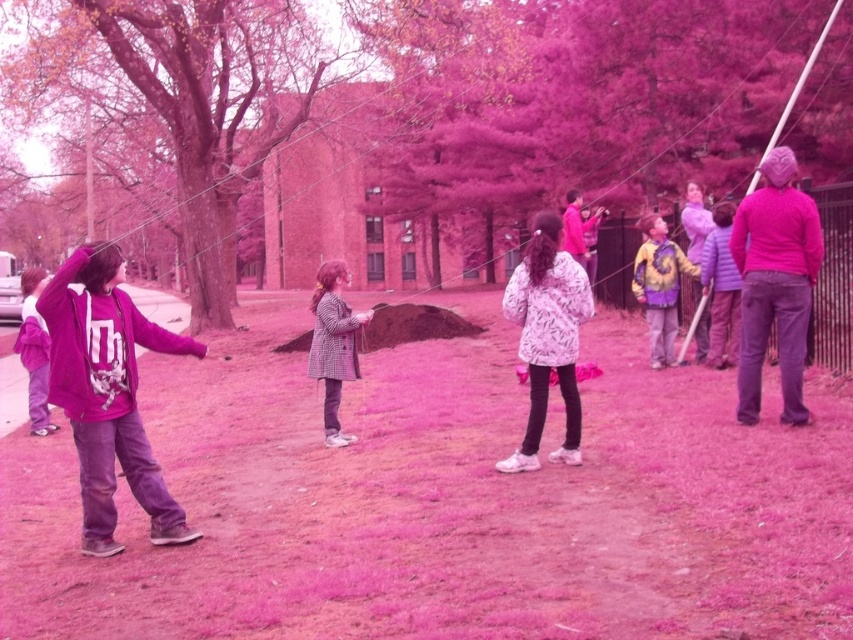
Question: Is purple matte hoodie at left thinner than white textured coat at center?

Choices:
 (A) no
 (B) yes

Answer: (A)

Question: Which point is farther to the camera?

Choices:
 (A) (334, 401)
 (B) (511, 275)

Answer: (B)

Question: Which point is closer to the camera?

Choices:
 (A) click(532, 360)
 (B) click(160, 500)
 (C) click(344, 276)

Answer: (B)

Question: Based on their relative distances, which object is farther from the pink matte tree at upper center?

Choices:
 (A) white textured coat at center
 (B) plaid wool coat at center
 (C) smooth bark tree at center

Answer: (A)

Question: Does pink matte tree at upper center have a lesser width compared to yellow tie-dye shirt at center?

Choices:
 (A) yes
 (B) no

Answer: (B)

Question: Is plaid wool coat at center closer to the viewer compared to purple fleece jacket at left?

Choices:
 (A) no
 (B) yes

Answer: (A)